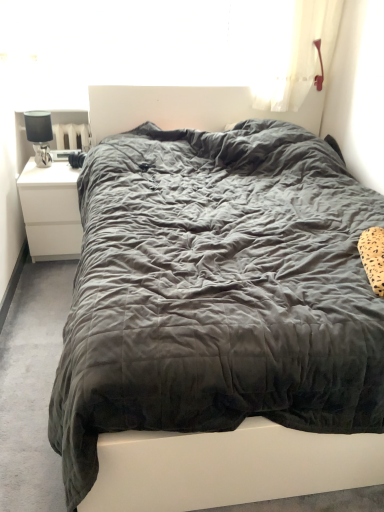
Question: Does satin black lamp at left appear on the right side of dark grey quilted bed at center?

Choices:
 (A) yes
 (B) no

Answer: (B)

Question: Would you say satin black lamp at left is outside dark grey quilted bed at center?

Choices:
 (A) yes
 (B) no

Answer: (A)

Question: Is satin black lamp at left closer to the viewer compared to dark grey quilted bed at center?

Choices:
 (A) yes
 (B) no

Answer: (B)

Question: From a real-world perspective, does satin black lamp at left sit lower than dark grey quilted bed at center?

Choices:
 (A) yes
 (B) no

Answer: (B)

Question: Considering the relative sizes of satin black lamp at left and dark grey quilted bed at center in the image provided, is satin black lamp at left taller than dark grey quilted bed at center?

Choices:
 (A) no
 (B) yes

Answer: (A)

Question: Is transparent plastic window screen at upper center taller or shorter than dark grey quilted bed at center?

Choices:
 (A) tall
 (B) short

Answer: (B)

Question: From a real-world perspective, is transparent plastic window screen at upper center physically located above or below dark grey quilted bed at center?

Choices:
 (A) above
 (B) below

Answer: (A)

Question: Based on their positions, is transparent plastic window screen at upper center located to the left or right of dark grey quilted bed at center?

Choices:
 (A) left
 (B) right

Answer: (A)

Question: In the image, is transparent plastic window screen at upper center positioned in front of or behind dark grey quilted bed at center?

Choices:
 (A) behind
 (B) front

Answer: (A)

Question: Considering their positions, is dark grey quilted bed at center located in front of or behind white matte nightstand at left?

Choices:
 (A) behind
 (B) front

Answer: (B)

Question: Is point (259, 153) positioned closer to the camera than point (66, 203)?

Choices:
 (A) closer
 (B) farther

Answer: (A)

Question: From a real-world perspective, is dark grey quilted bed at center physically located above or below white matte nightstand at left?

Choices:
 (A) above
 (B) below

Answer: (A)

Question: Considering the positions of dark grey quilted bed at center and white matte nightstand at left in the image, is dark grey quilted bed at center bigger or smaller than white matte nightstand at left?

Choices:
 (A) small
 (B) big

Answer: (B)

Question: Is dark grey quilted bed at center bigger or smaller than transparent plastic window screen at upper center?

Choices:
 (A) small
 (B) big

Answer: (B)

Question: Does point [x=162, y=268] appear closer or farther from the camera than point [x=109, y=39]?

Choices:
 (A) closer
 (B) farther

Answer: (A)